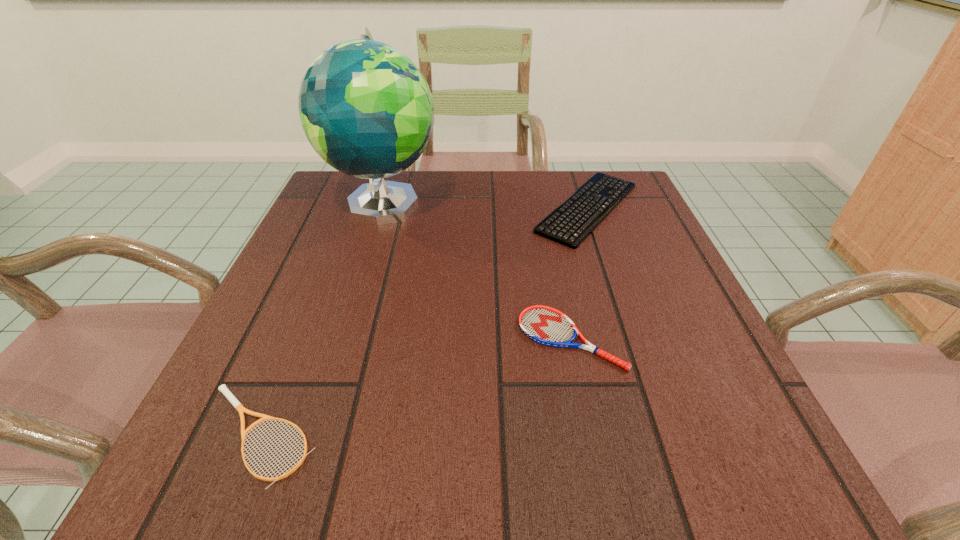
In the image, there is a desktop. Identify the location of vacant space at the far edge. (446, 206).

Locate an element on the screen. The height and width of the screenshot is (540, 960). vacant area at the near edge is located at coordinates (446, 451).

What are the coordinates of `free spot at the left edge of the desktop` in the screenshot? It's located at (309, 270).

Locate an element on the screen. free region at the right edge of the desktop is located at coordinates (638, 242).

Locate an element on the screen. The height and width of the screenshot is (540, 960). vacant point located between the farther tennis racket and the globe is located at coordinates (478, 271).

Locate an element on the screen. The image size is (960, 540). free area in between the farther tennis racket and the computer keyboard is located at coordinates (579, 273).

Locate an element on the screen. vacant area that lies between the tallest object and the nearest object is located at coordinates (322, 319).

Where is `unoccupied area between the computer keyboard and the shortest object`? Image resolution: width=960 pixels, height=540 pixels. unoccupied area between the computer keyboard and the shortest object is located at coordinates 423,321.

I want to click on free space between the tallest object and the computer keyboard, so click(x=486, y=205).

Find the location of a particular element. empty location between the shortest object and the computer keyboard is located at coordinates (423, 321).